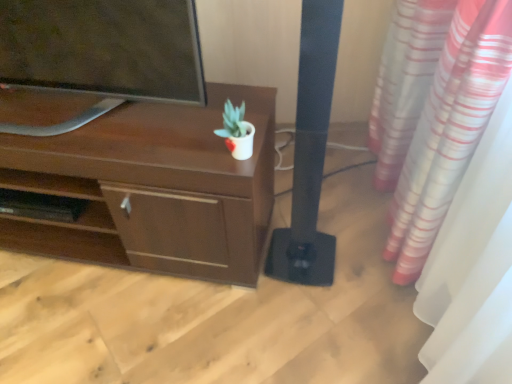
What is the approximate height of brown matte desk at upper left?

brown matte desk at upper left is 23.32 inches in height.

What do you see at coordinates (152, 189) in the screenshot?
I see `brown matte desk at upper left` at bounding box center [152, 189].

In order to click on white glossy pot at center in this screenshot , I will do `click(237, 131)`.

The width and height of the screenshot is (512, 384). In order to click on brown matte desk at upper left in this screenshot , I will do `click(152, 189)`.

Could you tell me if matte black tv at upper left is turned towards brown matte desk at upper left?

No, matte black tv at upper left is not turned towards brown matte desk at upper left.

Is matte black tv at upper left beside brown matte desk at upper left?

No, matte black tv at upper left is not beside brown matte desk at upper left.

Is matte black tv at upper left to the left of brown matte desk at upper left from the viewer's perspective?

Incorrect, matte black tv at upper left is not on the left side of brown matte desk at upper left.

From the image's perspective, which one is positioned lower, matte black tv at upper left or brown matte desk at upper left?

brown matte desk at upper left.

Is white glossy pot at center aimed at brown matte desk at upper left?

No, white glossy pot at center is not aimed at brown matte desk at upper left.

The width and height of the screenshot is (512, 384). I want to click on desk that is under the white glossy pot at center (from a real-world perspective), so click(152, 189).

From the image's perspective, between white glossy pot at center and brown matte desk at upper left, which one is located above?

white glossy pot at center.

Is white glossy pot at center at the right side of matte black tv at upper left?

Yes, white glossy pot at center is to the right of matte black tv at upper left.

How many degrees apart are the facing directions of white glossy pot at center and matte black tv at upper left?

The angular difference between white glossy pot at center and matte black tv at upper left is 1.87 degrees.

Where is `television located in front of the white glossy pot at center`? This screenshot has width=512, height=384. television located in front of the white glossy pot at center is located at coordinates (104, 48).

Can you confirm if black matte speaker at center is positioned to the left of brown matte desk at upper left?

No.

From a real-world perspective, is black matte speaker at center on brown matte desk at upper left?

Yes, from a real-world perspective, black matte speaker at center is above brown matte desk at upper left.

Considering the positions of objects black matte speaker at center and brown matte desk at upper left in the image provided, who is in front, black matte speaker at center or brown matte desk at upper left?

black matte speaker at center.

From the image's perspective, is black matte speaker at center located above brown matte desk at upper left?

Yes, from the image's perspective, black matte speaker at center is over brown matte desk at upper left.

In the scene shown: Between matte black tv at upper left and white glossy pot at center, which one has larger width?

Wider between the two is matte black tv at upper left.

Is matte black tv at upper left directly adjacent to white glossy pot at center?

No, matte black tv at upper left is not with white glossy pot at center.

Which of these two, matte black tv at upper left or white glossy pot at center, stands shorter?

white glossy pot at center is shorter.

Consider the image. From a real-world perspective, between white glossy pot at center and black matte speaker at center, who is vertically higher?

In real-world perspective, white glossy pot at center is above.

Could you tell me if white glossy pot at center is turned towards black matte speaker at center?

No, white glossy pot at center is not aimed at black matte speaker at center.

You are a GUI agent. You are given a task and a screenshot of the screen. Output one action in this format:
    pyautogui.click(x=<x>, y=<y>)
    Task: Click on the houseplant above the black matte speaker at center (from a real-world perspective)
    
    Given the screenshot: What is the action you would take?
    pyautogui.click(x=237, y=131)

From the image's perspective, is white glossy pot at center located above or below black matte speaker at center?

Clearly, from the image's perspective, white glossy pot at center is above black matte speaker at center.

From a real-world perspective, relative to white glossy pot at center, is black matte speaker at center vertically above or below?

From a real-world perspective, black matte speaker at center is physically below white glossy pot at center.

Between black matte speaker at center and white glossy pot at center, which one has larger size?

With larger size is black matte speaker at center.

The image size is (512, 384). I want to click on pillar that appears in front of the white glossy pot at center, so click(x=310, y=152).

Is black matte speaker at center to the left of white glossy pot at center from the viewer's perspective?

Incorrect, black matte speaker at center is not on the left side of white glossy pot at center.

Image resolution: width=512 pixels, height=384 pixels. What are the coordinates of `television above the brown matte desk at upper left (from a real-world perspective)` in the screenshot? It's located at (104, 48).

Image resolution: width=512 pixels, height=384 pixels. Identify the location of desk below the white glossy pot at center (from a real-world perspective). (152, 189).

When comparing their distances from brown matte desk at upper left, does white glossy pot at center or black matte speaker at center seem further?

black matte speaker at center lies further to brown matte desk at upper left than the other object.

Looking at the image, which one is located further to white glossy pot at center, brown matte desk at upper left or black matte speaker at center?

Among the two, brown matte desk at upper left is located further to white glossy pot at center.

When comparing their distances from matte black tv at upper left, does black matte speaker at center or white glossy pot at center seem further?

black matte speaker at center lies further to matte black tv at upper left than the other object.

Looking at this image, from the image, which object appears to be farther from white glossy pot at center, matte black tv at upper left or brown matte desk at upper left?

brown matte desk at upper left is further to white glossy pot at center.

Looking at the image, which one is located further to matte black tv at upper left, white glossy pot at center or black matte speaker at center?

black matte speaker at center is further to matte black tv at upper left.

Looking at the image, which one is located closer to black matte speaker at center, brown matte desk at upper left or white glossy pot at center?

white glossy pot at center is closer to black matte speaker at center.

Looking at the image, which one is located further to brown matte desk at upper left, matte black tv at upper left or white glossy pot at center?

white glossy pot at center is further to brown matte desk at upper left.

When comparing their distances from matte black tv at upper left, does brown matte desk at upper left or black matte speaker at center seem further?

black matte speaker at center.

You are a GUI agent. You are given a task and a screenshot of the screen. Output one action in this format:
    pyautogui.click(x=<x>, y=<y>)
    Task: Click on the television located between brown matte desk at upper left and white glossy pot at center in the left-right direction
    This screenshot has height=384, width=512.
    Given the screenshot: What is the action you would take?
    pyautogui.click(x=104, y=48)

Where is `houseplant between matte black tv at upper left and black matte speaker at center in the horizontal direction`? Image resolution: width=512 pixels, height=384 pixels. houseplant between matte black tv at upper left and black matte speaker at center in the horizontal direction is located at coordinates (237, 131).

Where is `television situated between brown matte desk at upper left and black matte speaker at center from left to right`? Image resolution: width=512 pixels, height=384 pixels. television situated between brown matte desk at upper left and black matte speaker at center from left to right is located at coordinates click(x=104, y=48).

Where is `houseplant located between brown matte desk at upper left and black matte speaker at center in the left-right direction`? houseplant located between brown matte desk at upper left and black matte speaker at center in the left-right direction is located at coordinates (237, 131).